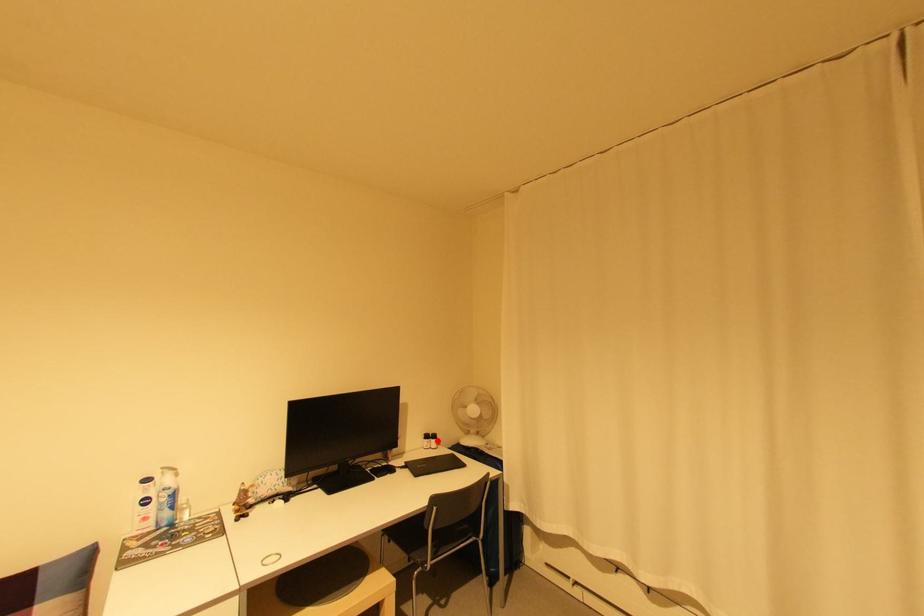
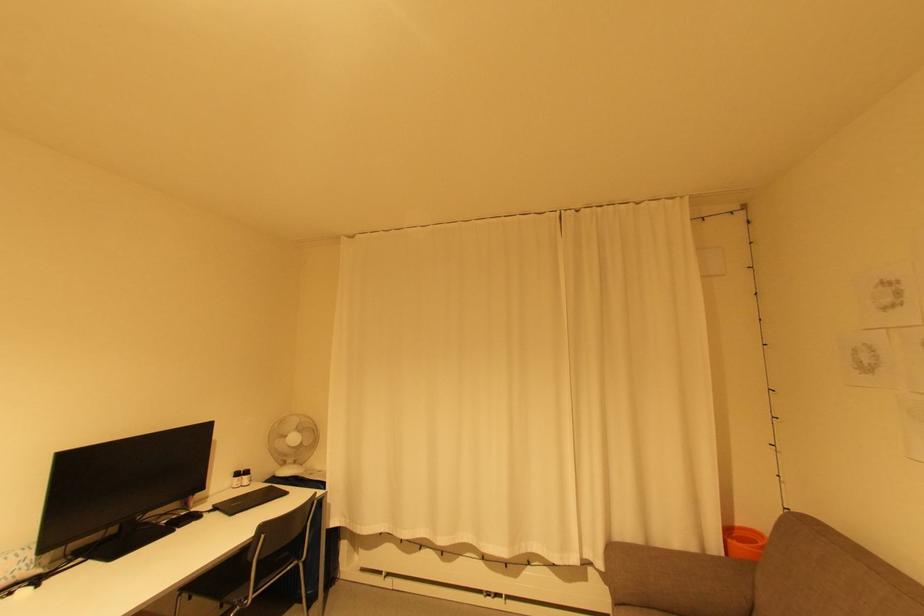
Question: I am providing you with two images of the same scene from different viewpoints. Image1 has a red point marked. In image2, the corresponding 3D location appears at what relative position? Reply with the corresponding letter.

Choices:
 (A) Closer
 (B) Farther

Answer: (A)